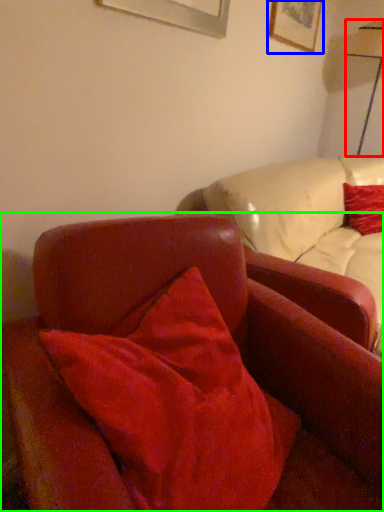
Question: Estimate the real-world distances between objects in this image. Which object is closer to table lamp (highlighted by a red box), picture frame (highlighted by a blue box) or chair (highlighted by a green box)?

Choices:
 (A) picture frame
 (B) chair

Answer: (A)